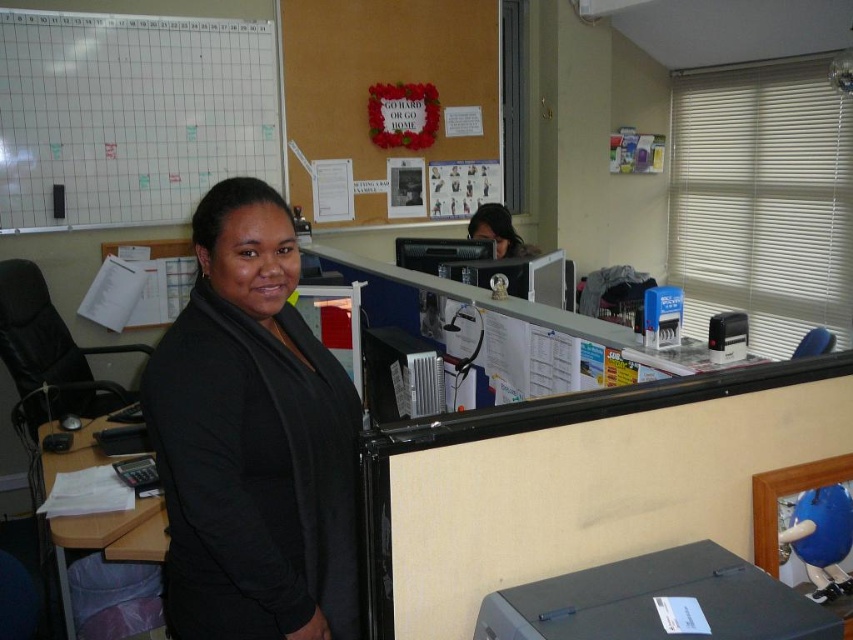
You are standing at the reception counter in the office scene. There are two points marked on the wall behind you. The first point is at coordinates point (44, 168) and the second is at point (381, 353). If you want to place a new notice closer to the bulletin board, which point should you choose?

Point (44, 168) is behind point (381, 353), so placing the notice at point (44, 168) would be closer to the bulletin board.